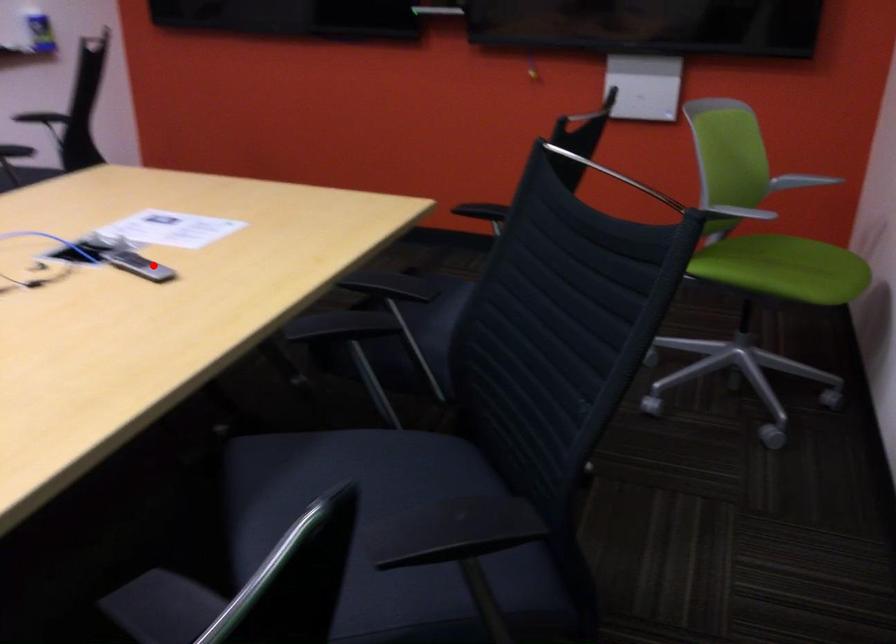
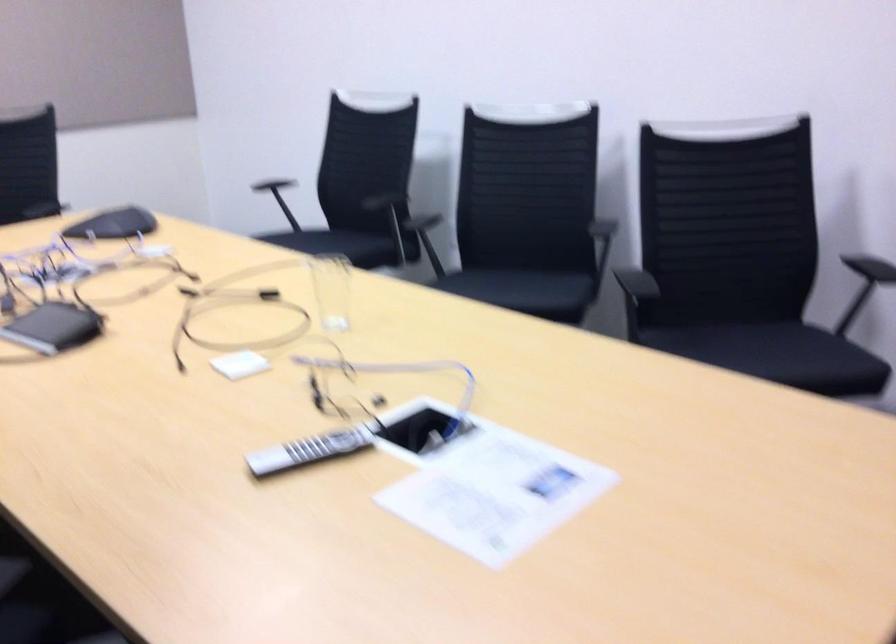
Question: I am providing you with two images of the same scene from different viewpoints. A red point is marked on the first image. At the location where the point appears in image 1, is it still visible in image 2?

Choices:
 (A) Yes
 (B) No

Answer: (A)